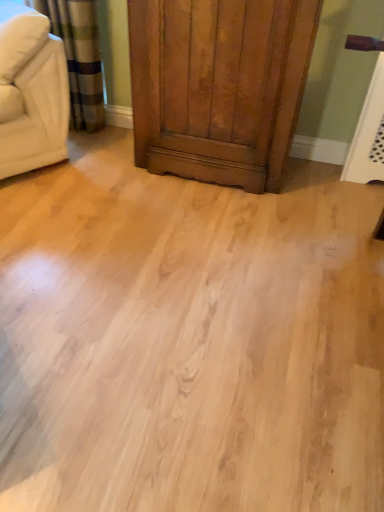
Question: Is shiny brown wood dresser at center not inside beige fabric couch at upper left?

Choices:
 (A) yes
 (B) no

Answer: (A)

Question: Considering the relative positions of shiny brown wood dresser at center and beige fabric couch at upper left in the image provided, is shiny brown wood dresser at center to the left of beige fabric couch at upper left from the viewer's perspective?

Choices:
 (A) yes
 (B) no

Answer: (B)

Question: From a real-world perspective, does shiny brown wood dresser at center stand above beige fabric couch at upper left?

Choices:
 (A) no
 (B) yes

Answer: (A)

Question: From the image's perspective, is shiny brown wood dresser at center under beige fabric couch at upper left?

Choices:
 (A) yes
 (B) no

Answer: (A)

Question: Is shiny brown wood dresser at center taller than beige fabric couch at upper left?

Choices:
 (A) yes
 (B) no

Answer: (A)

Question: Relative to beige fabric couch at upper left, is shiny brown wood dresser at center in front or behind?

Choices:
 (A) behind
 (B) front

Answer: (B)

Question: From a real-world perspective, is shiny brown wood dresser at center above or below beige fabric couch at upper left?

Choices:
 (A) above
 (B) below

Answer: (B)

Question: Considering the relative positions of shiny brown wood dresser at center and beige fabric couch at upper left in the image provided, is shiny brown wood dresser at center to the left or to the right of beige fabric couch at upper left?

Choices:
 (A) left
 (B) right

Answer: (B)

Question: Considering the positions of shiny brown wood dresser at center and beige fabric couch at upper left in the image, is shiny brown wood dresser at center wider or thinner than beige fabric couch at upper left?

Choices:
 (A) wide
 (B) thin

Answer: (A)

Question: Is light wood floor at center taller or shorter than shiny brown wood dresser at center?

Choices:
 (A) short
 (B) tall

Answer: (A)

Question: In the image, is light wood floor at center positioned in front of or behind shiny brown wood dresser at center?

Choices:
 (A) behind
 (B) front

Answer: (B)

Question: From the image's perspective, is light wood floor at center above or below shiny brown wood dresser at center?

Choices:
 (A) above
 (B) below

Answer: (B)

Question: From a real-world perspective, is light wood floor at center positioned above or below shiny brown wood dresser at center?

Choices:
 (A) below
 (B) above

Answer: (A)

Question: From the image's perspective, relative to shiny brown wood dresser at center, is beige fabric couch at upper left above or below?

Choices:
 (A) below
 (B) above

Answer: (B)

Question: Is point (28, 145) positioned closer to the camera than point (317, 16)?

Choices:
 (A) closer
 (B) farther

Answer: (B)